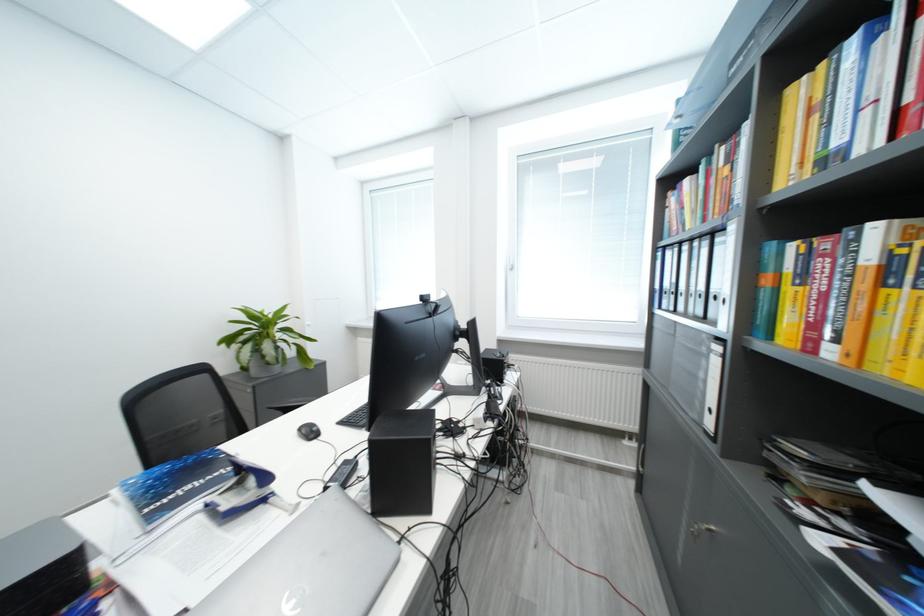
Locate an element on the screen. cabinet key is located at coordinates (706, 549).